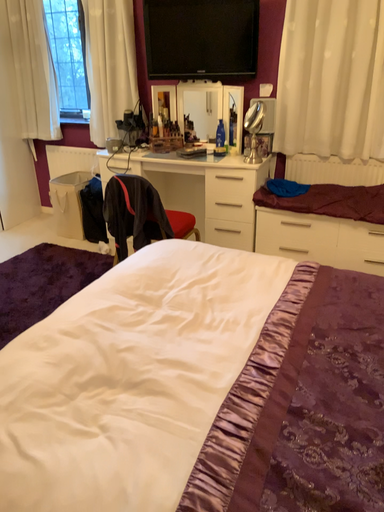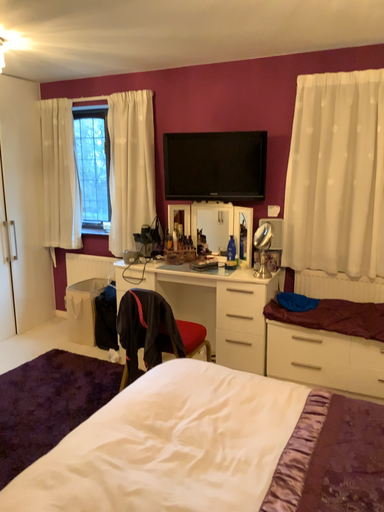
Question: How did the camera likely rotate when shooting the video?

Choices:
 (A) rotated downward
 (B) rotated upward

Answer: (B)